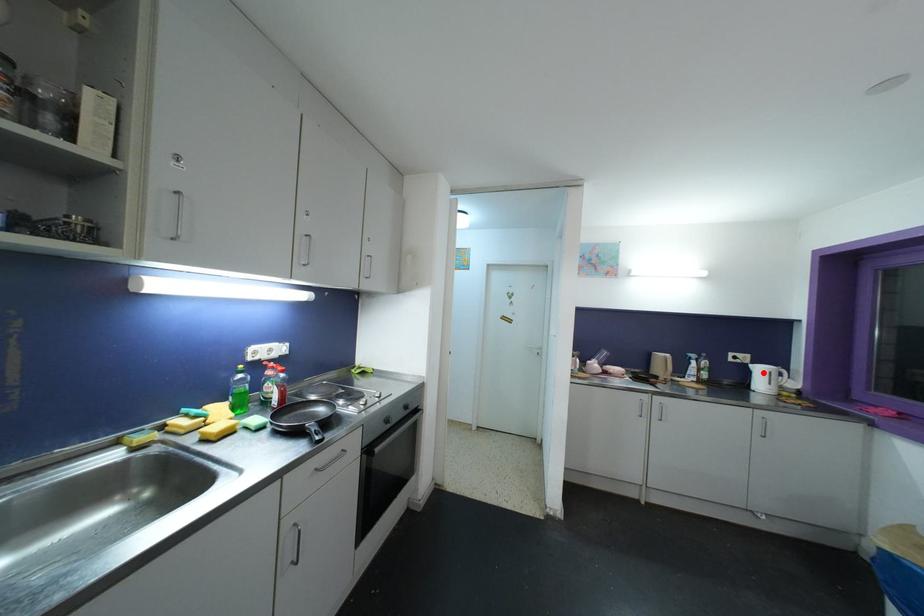
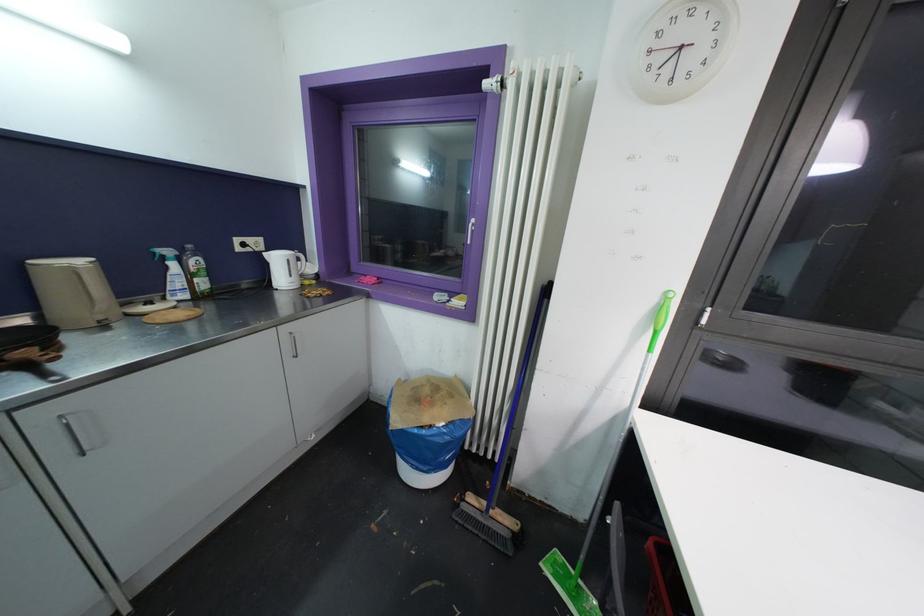
Where in the second image is the point corresponding to the highlighted location from the first image?

(281, 262)